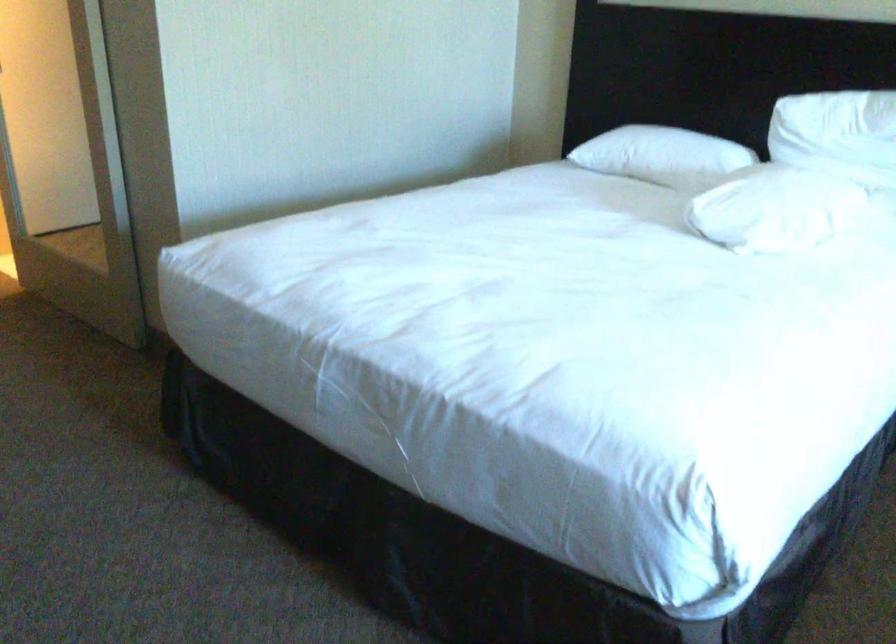
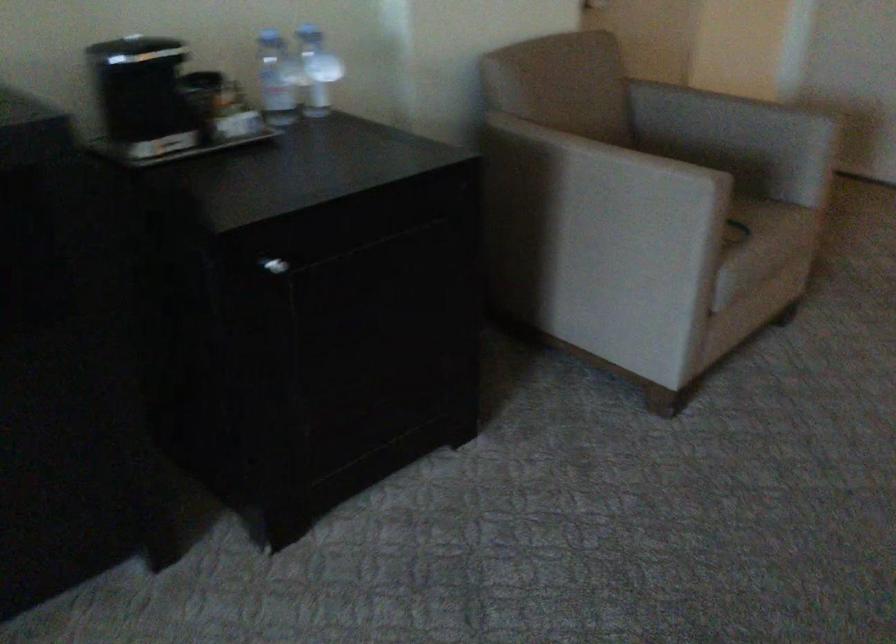
Based on the continuous images, in which direction is the camera rotating?

The camera's rotation is toward left-down.